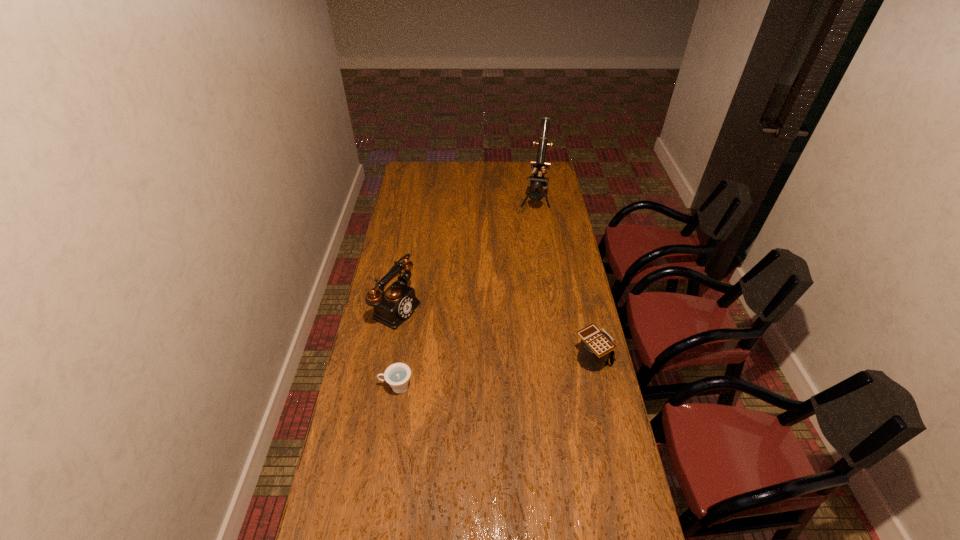
This screenshot has width=960, height=540. I want to click on free space located through the eyepiece of the microscope, so click(533, 222).

I want to click on vacant space located through the eyepiece of the microscope, so click(532, 228).

Where is `vacant space situated 0.360m on the front of the second tallest object at the rotary dial`? This screenshot has width=960, height=540. vacant space situated 0.360m on the front of the second tallest object at the rotary dial is located at coordinates (492, 357).

Where is `vacant space located 0.290m on the front of the second tallest object at the rotary dial`? The width and height of the screenshot is (960, 540). vacant space located 0.290m on the front of the second tallest object at the rotary dial is located at coordinates (476, 350).

You are a GUI agent. You are given a task and a screenshot of the screen. Output one action in this format:
    pyautogui.click(x=<x>, y=<y>)
    Task: Click on the vacant space located 0.280m on the front of the second tallest object at the rotary dial
    This screenshot has width=960, height=540.
    Given the screenshot: What is the action you would take?
    pyautogui.click(x=473, y=349)

Where is `teacup located at the left edge`? This screenshot has height=540, width=960. teacup located at the left edge is located at coordinates (397, 375).

Image resolution: width=960 pixels, height=540 pixels. In order to click on telephone located at the left edge in this screenshot , I will do `click(391, 307)`.

This screenshot has width=960, height=540. I want to click on calculator that is at the right edge, so click(596, 347).

Image resolution: width=960 pixels, height=540 pixels. Identify the location of microscope that is at the right edge. (540, 165).

In the image, there is a desktop. Where is `vacant region at the far edge`? vacant region at the far edge is located at coordinates (466, 179).